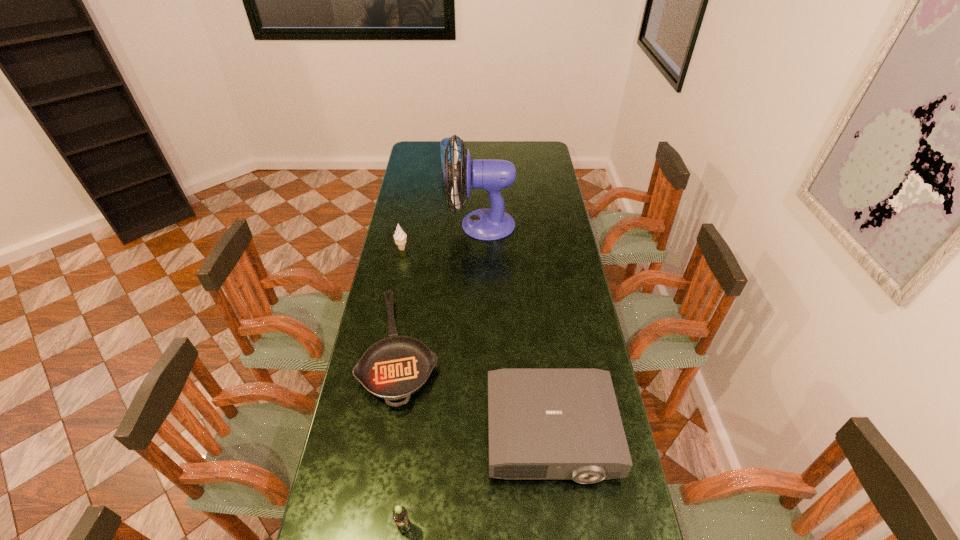
Find the location of a particular element. This screenshot has height=540, width=960. fan is located at coordinates (492, 175).

Identify the location of mug. (443, 143).

The width and height of the screenshot is (960, 540). I want to click on the farthest object, so click(x=443, y=143).

Find the location of `icecream`. icecream is located at coordinates (400, 236).

At what (x,y) coordinates should I click in order to perform the action: click on soda. Please return your answer as a coordinate pair (x, y). The width and height of the screenshot is (960, 540). Looking at the image, I should click on (400, 515).

Locate an element on the screen. This screenshot has width=960, height=540. projector is located at coordinates (542, 423).

You are a GUI agent. You are given a task and a screenshot of the screen. Output one action in this format:
    pyautogui.click(x=<x>, y=<y>)
    Task: Click on the shortest object
    This screenshot has height=540, width=960.
    Given the screenshot: What is the action you would take?
    pyautogui.click(x=394, y=368)

Image resolution: width=960 pixels, height=540 pixels. I want to click on free space located in front of the fan where the airflow is directed, so click(420, 225).

You are a GUI agent. You are given a task and a screenshot of the screen. Output one action in this format:
    pyautogui.click(x=<x>, y=<y>)
    Task: Click on the free space located in front of the fan where the airflow is directed
    
    Given the screenshot: What is the action you would take?
    pyautogui.click(x=414, y=225)

Locate an element on the screen. vacant region located in front of the fan where the airflow is directed is located at coordinates (419, 225).